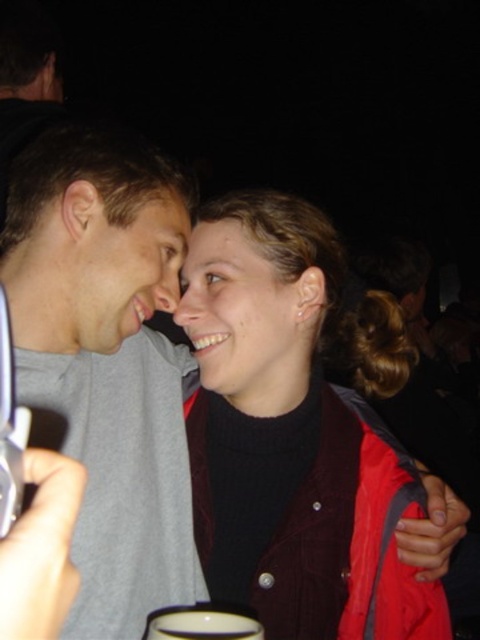
Does maroon corduroy jacket at center have a greater width compared to matte gray face at center?

Yes.

Looking at this image, can you confirm if maroon corduroy jacket at center is smaller than matte gray face at center?

A: Incorrect, maroon corduroy jacket at center is not smaller in size than matte gray face at center.

Image resolution: width=480 pixels, height=640 pixels. I want to click on maroon corduroy jacket at center, so click(x=288, y=436).

Is point (204, 276) positioned after point (117, 321)?

Yes, it is.

Who is positioned more to the right, matte black face at center or matte gray face at center?

Positioned to the right is matte black face at center.

Identify the location of matte black face at center. This screenshot has height=640, width=480. (241, 320).

Between maroon corduroy jacket at center and gray matte t-shirt at center, which one has less height?

With less height is maroon corduroy jacket at center.

The image size is (480, 640). What do you see at coordinates (288, 436) in the screenshot? I see `maroon corduroy jacket at center` at bounding box center [288, 436].

Identify the location of maroon corduroy jacket at center. This screenshot has height=640, width=480. (288, 436).